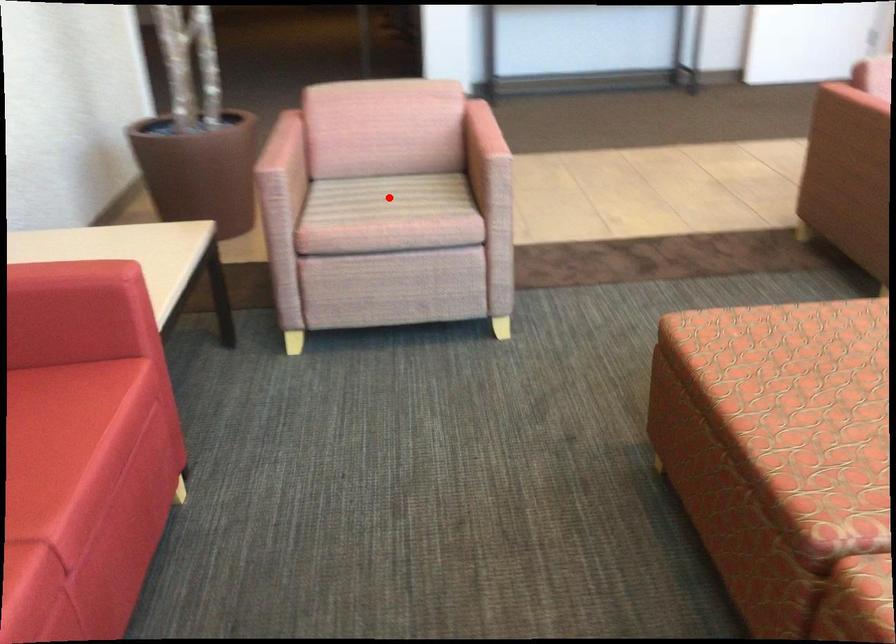
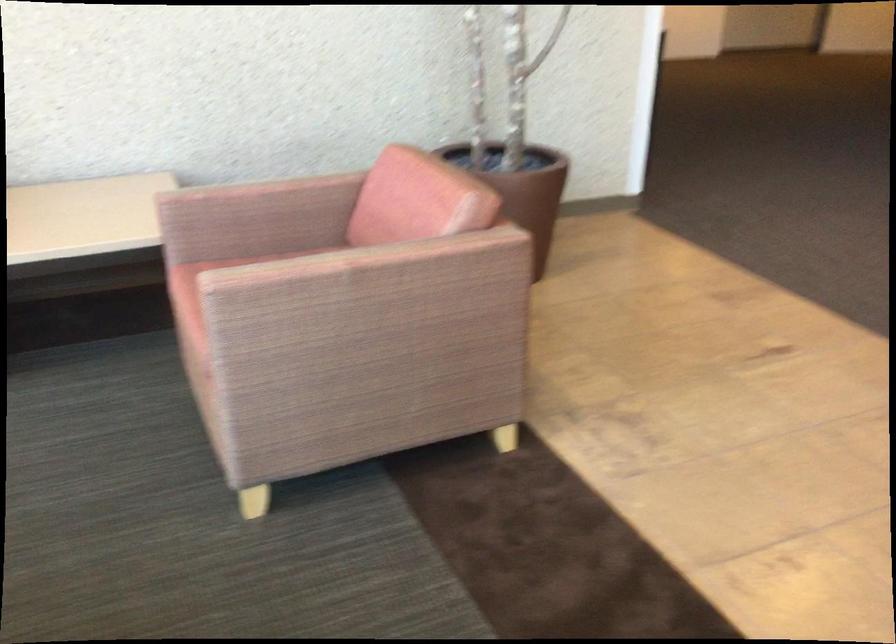
Question: I am providing you with two images of the same scene from different viewpoints. A red point is marked on the first image. At the location where the point appears in image 1, is it still visible in image 2?

Choices:
 (A) Yes
 (B) No

Answer: (B)